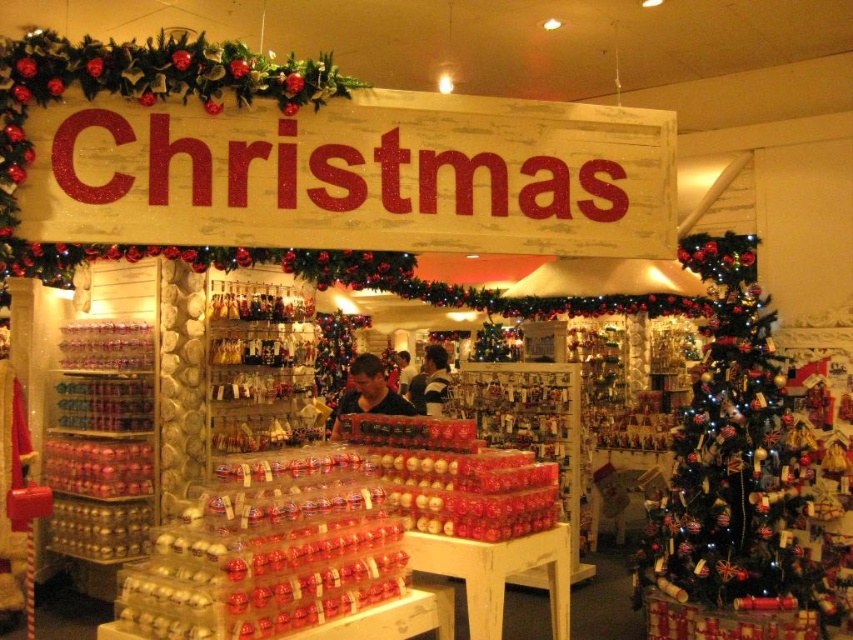
You are shopping for Christmas decorations and see the shiny metallic ornament at center and the matte black shirt at center. Which item is positioned lower on the shelf?

The shiny metallic ornament at center is located below the matte black shirt at center, so it is positioned lower on the shelf.

You are shopping for Christmas decorations and see both the shiny metallic ornament at center and the matte black shirt at center. Which item is positioned more to the right side?

The shiny metallic ornament at center is positioned to the right of the matte black shirt at center, so it is more to the right.